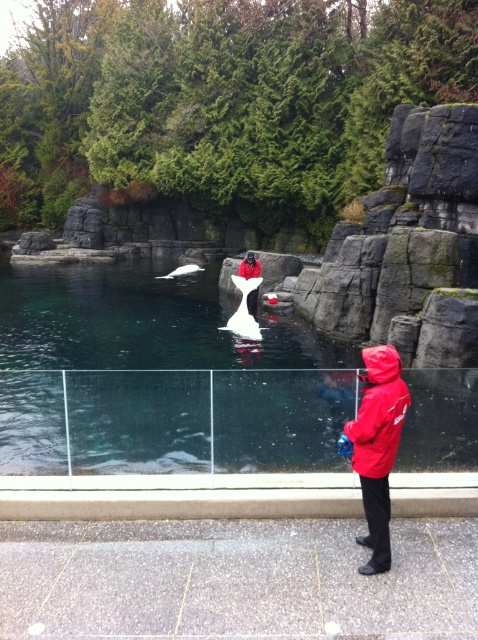
You are a visitor at the zoo and want to take a photo of both the red matte jacket at lower right and the red matte jacket at center. Which jacket should you focus on first to ensure both are in frame?

You should focus on the red matte jacket at center first because it occupies more space and is likely closer to the camera, allowing the smaller red matte jacket at lower right to be captured in the same frame.

You are a visitor at the zoo and want to take a photo of the clear glass water at center and the red matte jacket at center. Which object is wider in the image?

The clear glass water at center is wider than the red matte jacket at center according to the description.

You are a visitor at the zoo and want to take a photo of the beluga whale through the glass. There are two staff members in red jackets blocking your view. One is holding a blue object near the glass at point [373,394], and the other is further back at point [259,264]. Which staff member is closer to the glass barrier where you can see the whale?

The staff member at point [373,394] is closer to the glass barrier because the point [373,394] is in front of point [259,264].